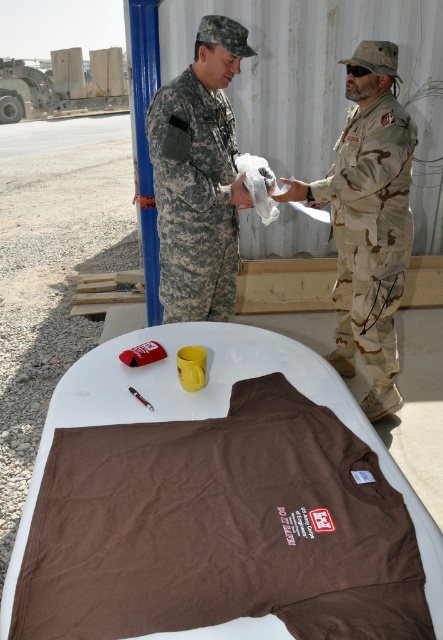
You are a photographer standing 5 feet away from the two people in the scene. You want to capture a photo that includes both the camouflage fabric uniform at right and the camouflage fabric uniform at center without any part of them being cut off. What is the minimum width of the camera lens you need to use?

The minimum width of the camera lens needed is 20.42 inches to ensure both the camouflage fabric uniform at right and the camouflage fabric uniform at center are fully visible without any part being cut off.

Based on the photo, you are a photographer standing in front of two military personnel. You need to take a photo of both the camouflage fabric uniform at right and the camouflage fabric uniform at center. Which one will appear larger in the photo?

The camouflage fabric uniform at right is further to the viewer than camouflage fabric uniform at center, so it will appear larger in the photo.

You are a photographer at a military ceremony. You need to capture a photo of both the camouflage fabric uniform at right and the camouflage fabric uniform at center. Based on their positions, which one should you focus on first to ensure both are in frame?

The camouflage fabric uniform at right is below the camouflage fabric uniform at center, so you should focus on the camouflage fabric uniform at center first to ensure both are in frame.